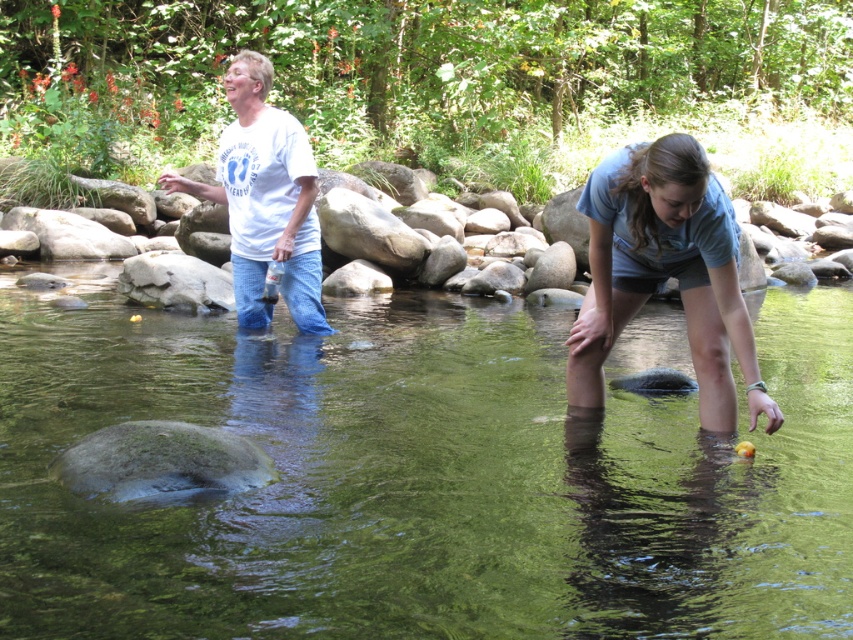
Question: Which point appears farthest from the camera in this image?

Choices:
 (A) (239, 140)
 (B) (16, 349)
 (C) (735, 310)
 (D) (703, 388)

Answer: (B)

Question: Does green translucent water at center come behind white cotton t-shirt at upper left?

Choices:
 (A) no
 (B) yes

Answer: (B)

Question: Does white cotton shirt at upper left have a greater width compared to light blue t-shirt at lower right?

Choices:
 (A) yes
 (B) no

Answer: (A)

Question: Which is nearer to the green translucent water at center?

Choices:
 (A) white cotton t-shirt at upper left
 (B) white cotton shirt at upper left
 (C) light blue t-shirt at lower right

Answer: (A)

Question: Which point appears closest to the camera in this image?

Choices:
 (A) (450, 547)
 (B) (732, 422)

Answer: (A)

Question: Is light blue t-shirt at lower right to the left of white cotton t-shirt at upper left from the viewer's perspective?

Choices:
 (A) no
 (B) yes

Answer: (A)